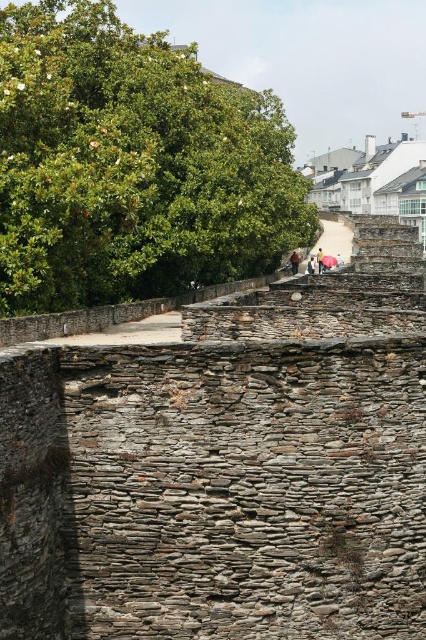
Does brown leather jacket at center have a larger size compared to light brown leather jacket at upper center?

No, brown leather jacket at center is not bigger than light brown leather jacket at upper center.

Is brown leather jacket at center taller than light brown leather jacket at upper center?

In fact, brown leather jacket at center may be shorter than light brown leather jacket at upper center.

Is point (296, 259) farther from camera compared to point (310, 269)?

Yes, point (296, 259) is farther from viewer.

The width and height of the screenshot is (426, 640). I want to click on brown leather jacket at center, so click(x=294, y=260).

Does brown leather jacket at center have a greater width compared to matte pink umbrella at upper center?

No, brown leather jacket at center is not wider than matte pink umbrella at upper center.

Find the location of a particular element. brown leather jacket at center is located at coordinates (294, 260).

Locate an element on the screen. This screenshot has height=640, width=426. brown leather jacket at center is located at coordinates (294, 260).

Between point (290, 262) and point (342, 257), which one is positioned behind?

The point (342, 257) is more distant.

Which is in front, point (290, 262) or point (336, 257)?

Positioned in front is point (336, 257).

This screenshot has height=640, width=426. I want to click on brown leather jacket at center, so click(x=294, y=260).